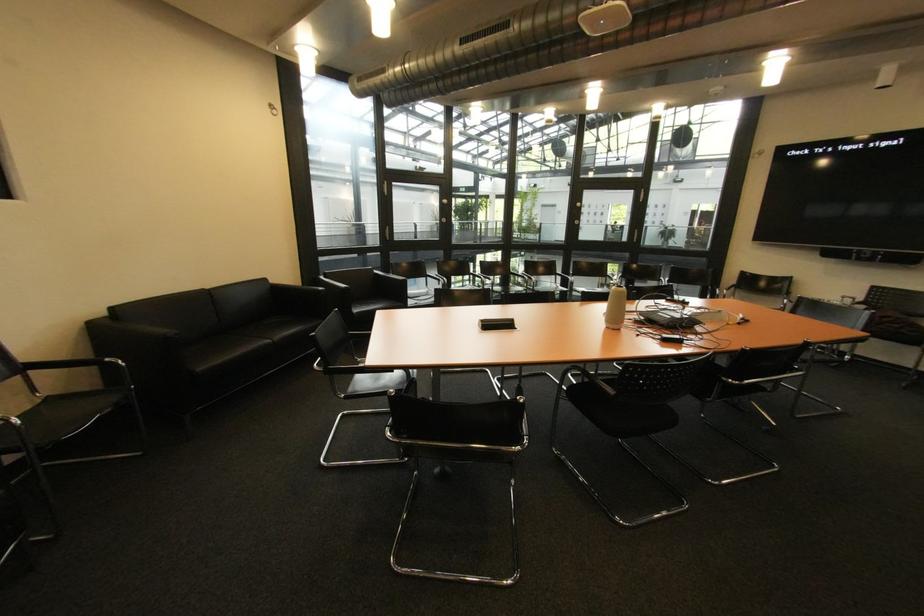
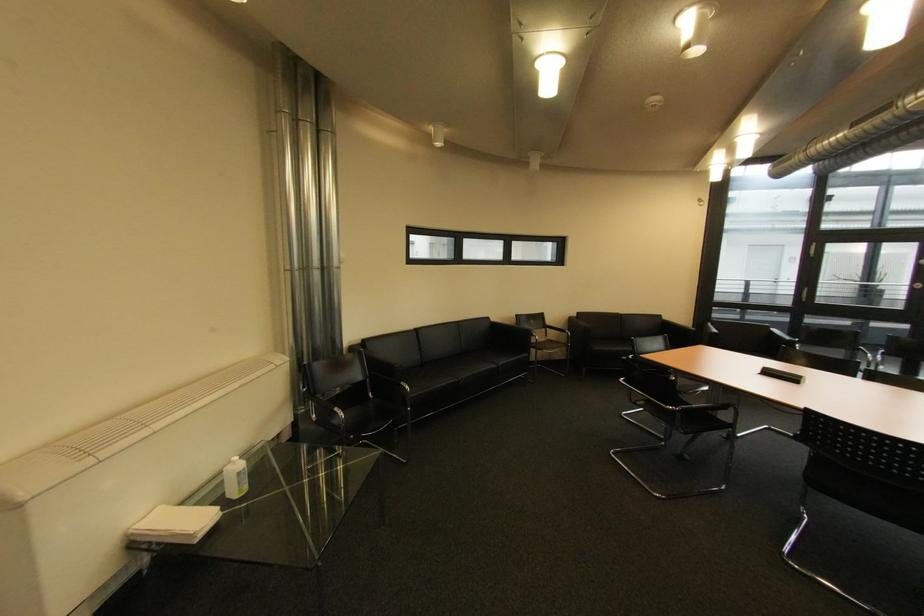
Locate, in the second image, the point that corresponds to point 39,373 in the first image.

(555, 330)